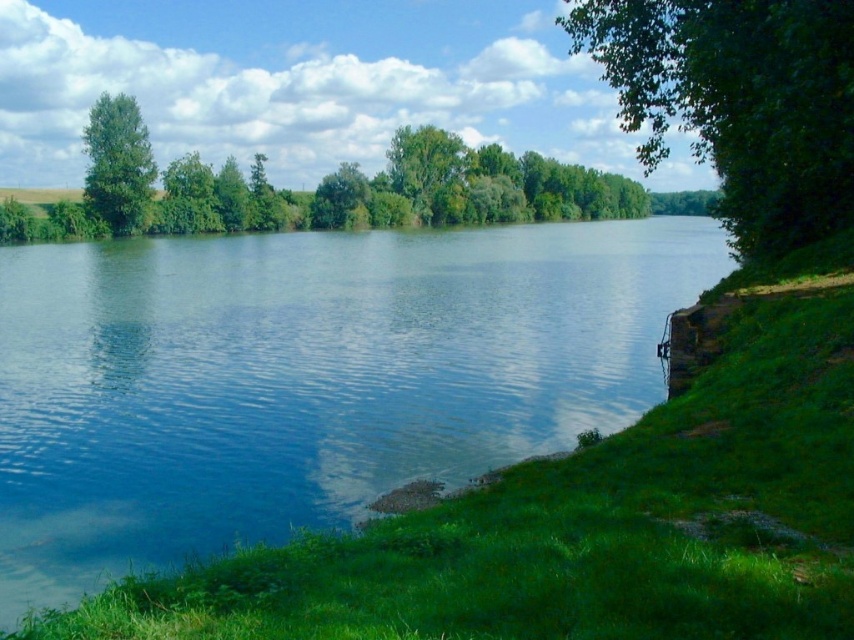
You are standing at the point marked as point (118,163) in the image. What object is directly in front of you?

The green leafy tree at upper left is located at point (118,163), so the object directly in front of you is the green leafy tree at upper left.

You are standing at the point marked by the coordinates point (305, 378) in this riverside scene. Based on the description, what would you most likely see around you?

The point (305, 378) indicates clear blue water at center, so you would most likely be surrounded by clear blue water at center in the riverside scene.